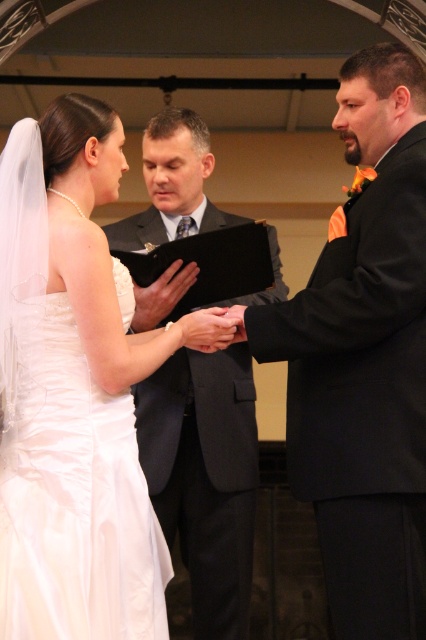
You are a photographer setting up for the wedding ceremony. You need to ensure that both the white satin dress at left and the matte black suit at center are fully visible in your shot. Given their widths, which one requires more space in the frame to capture their full silhouette?

The matte black suit at center requires more space in the frame because it has a greater width than the white satin dress at left.

You are standing at the back of the venue and want to walk to the officiant. There are two points marked in the image, point 1 at coordinates point (86, 426) and point 2 at coordinates point (203, 552). Which point should you walk towards to get closer to the officiant?

Point 1 at coordinates point (86, 426) is in front of point 2 at coordinates point (203, 552), so walking towards point 1 will bring you closer to the officiant.